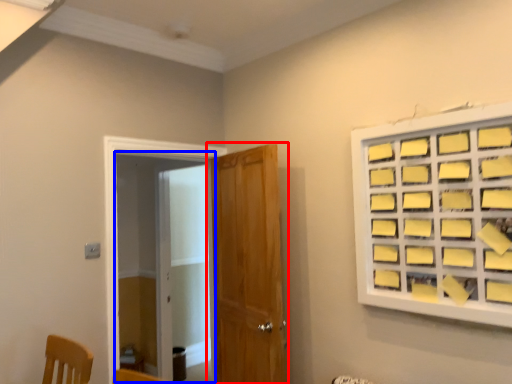
Question: Which of the following is the farthest to the observer, door (highlighted by a red box) or screen door (highlighted by a blue box)?

Choices:
 (A) door
 (B) screen door

Answer: (B)